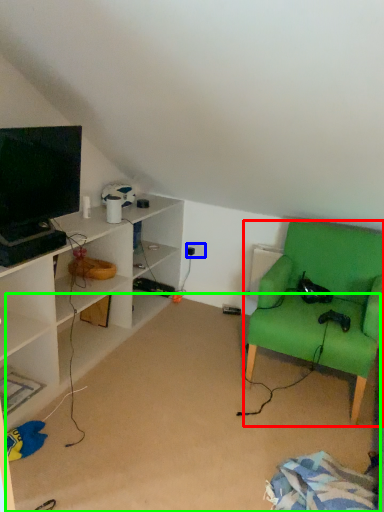
Question: Based on their relative distances, which object is nearer to chair (highlighted by a red box)? Choose from electric outlet (highlighted by a blue box) and plain (highlighted by a green box).

Choices:
 (A) electric outlet
 (B) plain

Answer: (B)